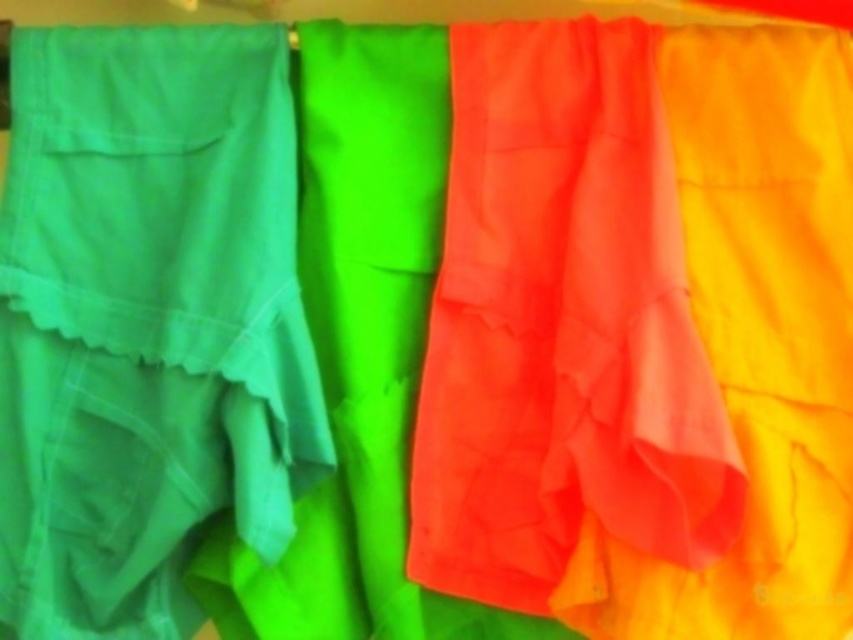
What do you see at coordinates (146, 321) in the screenshot? I see `matte green skirt at left` at bounding box center [146, 321].

Can you confirm if matte green skirt at left is thinner than matte orange fabric at center?

No.

The image size is (853, 640). Describe the element at coordinates (146, 321) in the screenshot. I see `matte green skirt at left` at that location.

I want to click on matte green skirt at left, so coord(146,321).